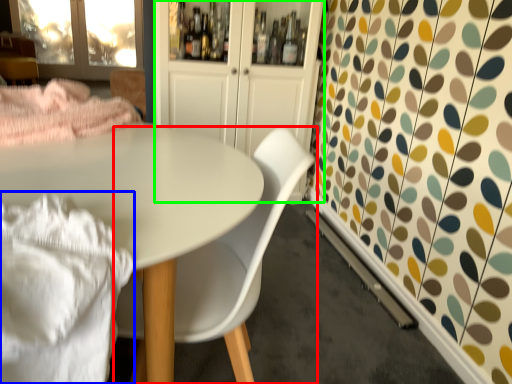
Question: Based on their relative distances, which object is nearer to chair (highlighted by a red box)? Choose from blanket (highlighted by a blue box) and dresser (highlighted by a green box).

Choices:
 (A) blanket
 (B) dresser

Answer: (A)